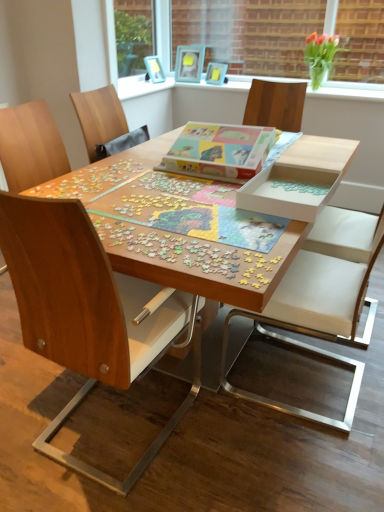
Identify the location of vacant location below white leather chair at center, marked as the first chair in a right-to-left arrangement (from a real-world perspective). (324, 388).